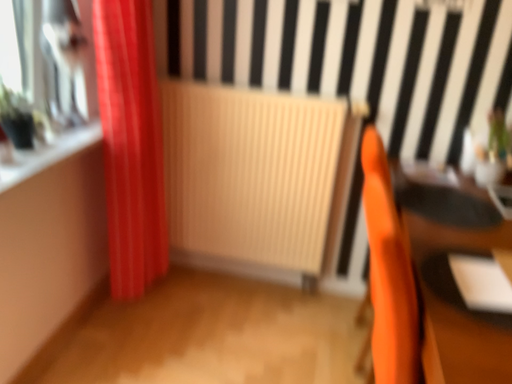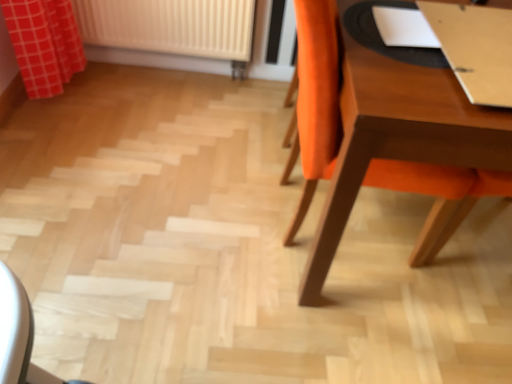
Question: How did the camera likely rotate when shooting the video?

Choices:
 (A) rotated right
 (B) rotated left

Answer: (A)